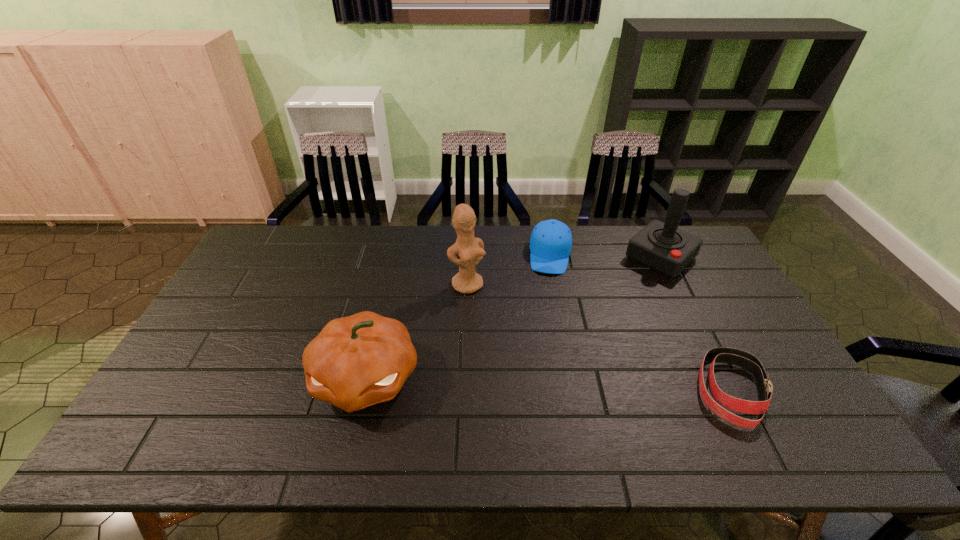
You are a GUI agent. You are given a task and a screenshot of the screen. Output one action in this format:
    pyautogui.click(x=<x>, y=<y>)
    Task: Click on the free space between the joystick and the leftmost object
    The width and height of the screenshot is (960, 540).
    Given the screenshot: What is the action you would take?
    pyautogui.click(x=513, y=318)

This screenshot has width=960, height=540. Find the location of `vacant area that lies between the second shortest object and the dog collar`. vacant area that lies between the second shortest object and the dog collar is located at coordinates (641, 322).

Where is `free space that is in between the third object from left to right and the joystick`? The image size is (960, 540). free space that is in between the third object from left to right and the joystick is located at coordinates (606, 256).

Where is `vacant point located between the shortest object and the third shortest object`? vacant point located between the shortest object and the third shortest object is located at coordinates (549, 384).

You are a GUI agent. You are given a task and a screenshot of the screen. Output one action in this format:
    pyautogui.click(x=<x>, y=<y>)
    Task: Click on the empty location between the joystick and the dog collar
    This screenshot has height=540, width=960.
    Given the screenshot: What is the action you would take?
    pyautogui.click(x=696, y=324)

Find the location of a particular element. The height and width of the screenshot is (540, 960). vacant space that is in between the shortest object and the joystick is located at coordinates (696, 324).

Image resolution: width=960 pixels, height=540 pixels. In order to click on vacant region between the second object from left to right and the cap in this screenshot , I will do `click(509, 270)`.

Where is `free spot between the dog collar and the pumpkin`? The width and height of the screenshot is (960, 540). free spot between the dog collar and the pumpkin is located at coordinates (549, 384).

The height and width of the screenshot is (540, 960). In order to click on the third closest object to the leftmost object in this screenshot , I will do `click(662, 247)`.

Choose which object is the second nearest neighbor to the joystick. Please provide its 2D coordinates. Your answer should be formatted as a tuple, i.e. [(x, y)], where the tuple contains the x and y coordinates of a point satisfying the conditions above.

[(743, 359)]